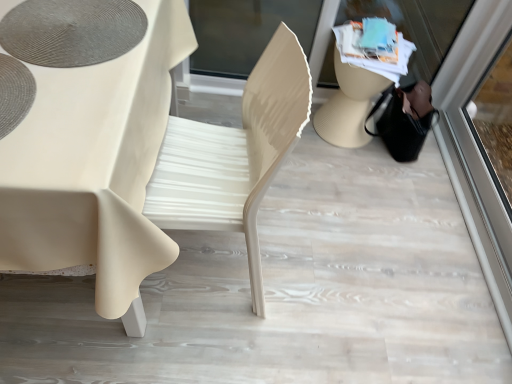
At what (x,y) coordinates should I click in order to perform the action: click on matte beige chair at center. Please return your answer as a coordinate pair (x, y). The image size is (512, 384). Looking at the image, I should click on [x=234, y=155].

The image size is (512, 384). In order to click on matte white table at center in this screenshot , I will do `click(95, 168)`.

Where is `transparent glass screen door at right`? The image size is (512, 384). transparent glass screen door at right is located at coordinates (477, 147).

What is the approximate width of transparent glass shop window at upper right?

transparent glass shop window at upper right is 3.17 inches wide.

In order to click on matte beige chair at center in this screenshot , I will do `click(234, 155)`.

Is matte beige chair at center in contact with transparent glass screen door at right?

No, matte beige chair at center is not beside transparent glass screen door at right.

Considering the positions of objects matte beige chair at center and transparent glass screen door at right in the image provided, who is more to the right, matte beige chair at center or transparent glass screen door at right?

transparent glass screen door at right.

Can you confirm if matte beige chair at center is wider than transparent glass screen door at right?

Yes.

Which is in front, point (246, 102) or point (493, 58)?

The point (246, 102) is in front.

Is transparent glass shop window at upper right aimed at matte white table at center?

Yes, transparent glass shop window at upper right is turned towards matte white table at center.

Where is `shop window on the right of matte white table at center`? Image resolution: width=512 pixels, height=384 pixels. shop window on the right of matte white table at center is located at coordinates (245, 32).

Are transparent glass shop window at upper right and matte white table at center making contact?

No, transparent glass shop window at upper right is not next to matte white table at center.

Is transparent glass shop window at upper right completely or partially outside of matte white table at center?

Yes, transparent glass shop window at upper right is not within matte white table at center.

Between matte gray placemat at upper left and transparent glass shop window at upper right, which one has more height?

transparent glass shop window at upper right is taller.

Is matte gray placemat at upper left to the left of transparent glass shop window at upper right from the viewer's perspective?

Correct, you'll find matte gray placemat at upper left to the left of transparent glass shop window at upper right.

From the image's perspective, which is above, matte gray placemat at upper left or transparent glass shop window at upper right?

transparent glass shop window at upper right appears higher in the image.

Is transparent glass screen door at right in front of or behind transparent glass shop window at upper right in the image?

In the image, transparent glass screen door at right appears in front of transparent glass shop window at upper right.

Which object is positioned more to the right, transparent glass screen door at right or transparent glass shop window at upper right?

transparent glass screen door at right.

Choose the correct answer: Is transparent glass screen door at right inside transparent glass shop window at upper right or outside it?

transparent glass screen door at right exists outside the volume of transparent glass shop window at upper right.

Is transparent glass screen door at right positioned far away from transparent glass shop window at upper right?

No, transparent glass screen door at right is not far from transparent glass shop window at upper right.

Is matte beige chair at center outside of matte gray placemat at upper left?

matte beige chair at center is positioned outside matte gray placemat at upper left.

Looking at this image, from a real-world perspective, who is located higher, matte beige chair at center or matte gray placemat at upper left?

matte gray placemat at upper left is physically above.

Is matte beige chair at center facing towards matte gray placemat at upper left?

Yes, matte beige chair at center is aimed at matte gray placemat at upper left.

Consider the image. From the image's perspective, who appears lower, matte beige chair at center or matte gray placemat at upper left?

From the image's view, matte beige chair at center is below.

Is matte white table at center oriented away from transparent glass screen door at right?

No, matte white table at center is not facing the opposite direction of transparent glass screen door at right.

Can you confirm if matte white table at center is taller than transparent glass screen door at right?

Yes.

Is matte white table at center next to transparent glass screen door at right?

matte white table at center and transparent glass screen door at right are not in contact.

Does matte white table at center lie behind transparent glass screen door at right?

No, it is in front of transparent glass screen door at right.

Is transparent glass screen door at right looking in the opposite direction of matte gray placemat at upper left?

No.

From a real-world perspective, is transparent glass screen door at right on top of matte gray placemat at upper left?

No, from a real-world perspective, transparent glass screen door at right is not over matte gray placemat at upper left

Considering the relative sizes of transparent glass screen door at right and matte gray placemat at upper left in the image provided, is transparent glass screen door at right thinner than matte gray placemat at upper left?

Yes.

Where is `chair on the left side of transparent glass screen door at right`? The width and height of the screenshot is (512, 384). chair on the left side of transparent glass screen door at right is located at coordinates (234, 155).

Where is `table above the transparent glass shop window at upper right (from a real-world perspective)`? The width and height of the screenshot is (512, 384). table above the transparent glass shop window at upper right (from a real-world perspective) is located at coordinates (95, 168).

From the image, which object appears to be farther from transparent glass shop window at upper right, matte white table at center or transparent glass screen door at right?

Based on the image, matte white table at center appears to be further to transparent glass shop window at upper right.

Which object lies nearer to the anchor point transparent glass shop window at upper right, transparent glass screen door at right or matte white table at center?

Based on the image, transparent glass screen door at right appears to be nearer to transparent glass shop window at upper right.

When comparing their distances from matte gray placemat at upper left, does matte white table at center or transparent glass shop window at upper right seem closer?

matte white table at center is positioned closer to the anchor matte gray placemat at upper left.

Which object lies further to the anchor point transparent glass shop window at upper right, matte beige chair at center or transparent glass screen door at right?

matte beige chair at center is positioned further to the anchor transparent glass shop window at upper right.

Estimate the real-world distances between objects in this image. Which object is further from matte white table at center, matte gray placemat at upper left or transparent glass shop window at upper right?

Among the two, transparent glass shop window at upper right is located further to matte white table at center.

Looking at this image, from the image, which object appears to be farther from transparent glass shop window at upper right, matte white table at center or matte gray placemat at upper left?

matte white table at center lies further to transparent glass shop window at upper right than the other object.

Considering their positions, is transparent glass shop window at upper right positioned further to matte beige chair at center than matte white table at center?

transparent glass shop window at upper right.

From the image, which object appears to be farther from transparent glass screen door at right, matte white table at center or matte beige chair at center?

matte white table at center.

The width and height of the screenshot is (512, 384). I want to click on oval between matte white table at center and transparent glass shop window at upper right in the front-back direction, so click(72, 31).

Where is `chair between matte gray placemat at upper left and transparent glass screen door at right from left to right`? Image resolution: width=512 pixels, height=384 pixels. chair between matte gray placemat at upper left and transparent glass screen door at right from left to right is located at coordinates (234, 155).

You are a GUI agent. You are given a task and a screenshot of the screen. Output one action in this format:
    pyautogui.click(x=<x>, y=<y>)
    Task: Click on the oval between matte white table at center and matte beige chair at center in the horizontal direction
    
    Given the screenshot: What is the action you would take?
    pyautogui.click(x=72, y=31)

Locate an element on the screen. This screenshot has width=512, height=384. oval between matte beige chair at center and transparent glass shop window at upper right in the front-back direction is located at coordinates tap(72, 31).